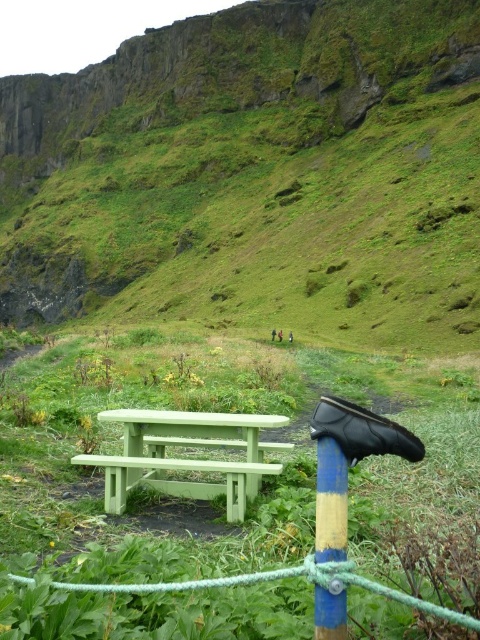
You are planning to set up a small tent for a picnic. You have two options for placement based on the image provided. The first option is on the green grassy hillside at center, and the second option is on the green painted wood bench at center. Considering the space required for the tent, which location would be more suitable?

The green grassy hillside at center has a larger width than the green painted wood bench at center, making it more suitable for setting up a small tent due to the available space.

You are planning to set up a small tent in the area. Based on the image, which object would provide a better foundation for the tent, the green grassy hillside at center or the blue painted wood pole at center? Explain your choice using the spatial details provided.

The green grassy hillside at center is wider than the blue painted wood pole at center, making it a more stable and spacious foundation for setting up a tent.

You are planning to set up a small tent for a picnic. You have a green painted wood bench at center and a blue painted wood pole at center in the image. Which object is located above the other?

The blue painted wood pole at center is positioned above the green painted wood bench at center.